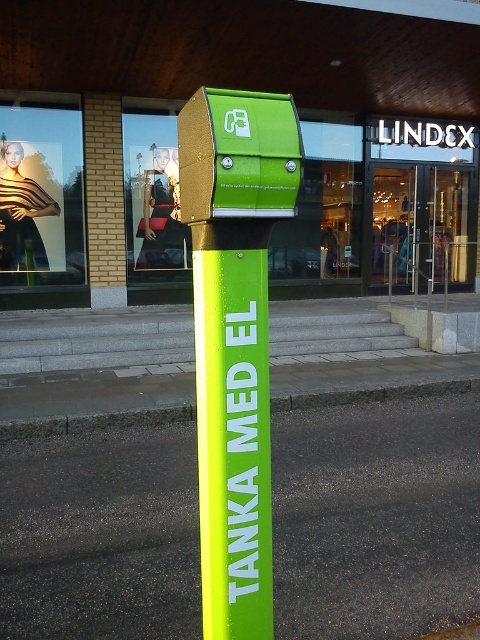
Between neon green plastic post at center and green rubber curb at lower center, which one has more height?

Standing taller between the two is neon green plastic post at center.

Is neon green plastic post at center taller than green rubber curb at lower center?

Yes, neon green plastic post at center is taller than green rubber curb at lower center.

Which is in front, point (235, 356) or point (465, 388)?

Point (235, 356) is more forward.

The image size is (480, 640). In order to click on neon green plastic post at center in this screenshot , I will do `click(232, 428)`.